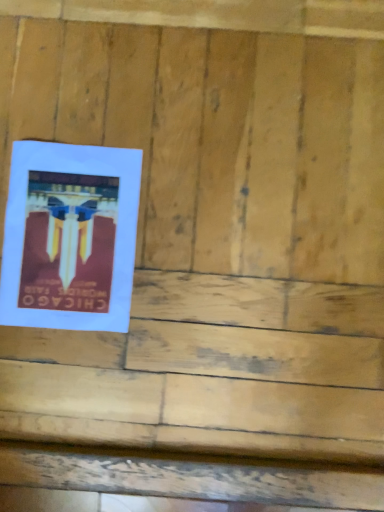
Locate an element on the screen. This screenshot has width=384, height=512. matte paper picture frame at upper left is located at coordinates (70, 236).

What do you see at coordinates (70, 236) in the screenshot? I see `matte paper picture frame at upper left` at bounding box center [70, 236].

Locate an element on the screen. The image size is (384, 512). matte paper picture frame at upper left is located at coordinates (70, 236).